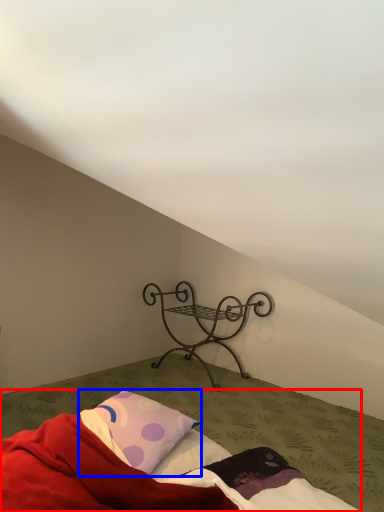
Question: Which point is further to the camera, bed (highlighted by a red box) or pillow (highlighted by a blue box)?

Choices:
 (A) bed
 (B) pillow

Answer: (B)